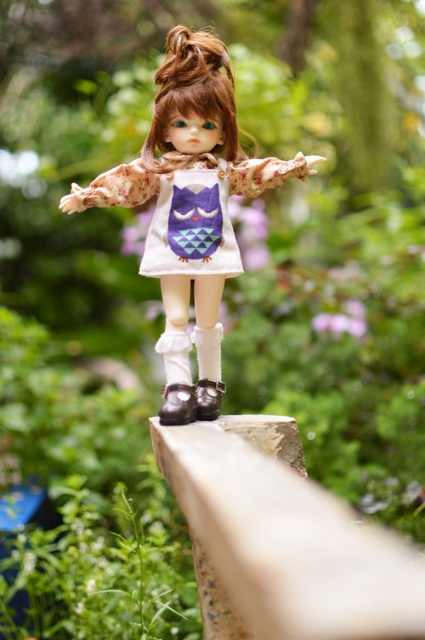
Does wooden rail at center have a larger size compared to white matte dress at center?

Indeed, wooden rail at center has a larger size compared to white matte dress at center.

Which is behind, point (333, 620) or point (237, 256)?

Point (237, 256)

The height and width of the screenshot is (640, 425). What do you see at coordinates (283, 540) in the screenshot?
I see `wooden rail at center` at bounding box center [283, 540].

What are the coordinates of `wooden rail at center` in the screenshot? It's located at coord(283,540).

Between matte white dress at center and shiny brown shoe at lower center, which one is positioned lower?

shiny brown shoe at lower center is below.

Can you confirm if matte white dress at center is positioned below shiny brown shoe at lower center?

No.

This screenshot has width=425, height=640. What do you see at coordinates (189, 195) in the screenshot? I see `matte white dress at center` at bounding box center [189, 195].

Identify the location of matte white dress at center. (189, 195).

The height and width of the screenshot is (640, 425). What do you see at coordinates (189, 195) in the screenshot? I see `matte white dress at center` at bounding box center [189, 195].

Who is positioned more to the left, matte white dress at center or shiny black leather shoe at lower center?

Positioned to the left is matte white dress at center.

You are a GUI agent. You are given a task and a screenshot of the screen. Output one action in this format:
    pyautogui.click(x=<x>, y=<y>)
    Task: Click on the matte white dress at center
    The image size is (425, 640).
    Given the screenshot: What is the action you would take?
    pyautogui.click(x=189, y=195)

Locate an element on the screen. This screenshot has width=425, height=640. matte white dress at center is located at coordinates (189, 195).